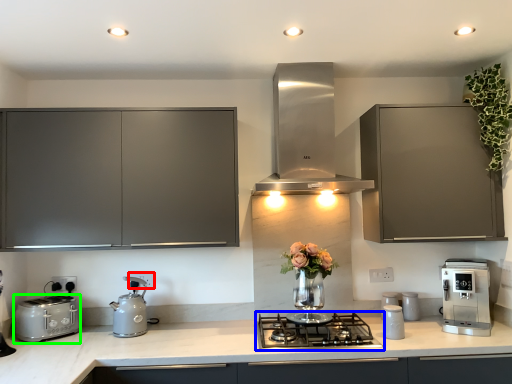
Question: Which object is the closest to the electric outlet (highlighted by a red box)? Choose among these: gas stove (highlighted by a blue box) or toaster (highlighted by a green box).

Choices:
 (A) gas stove
 (B) toaster

Answer: (B)